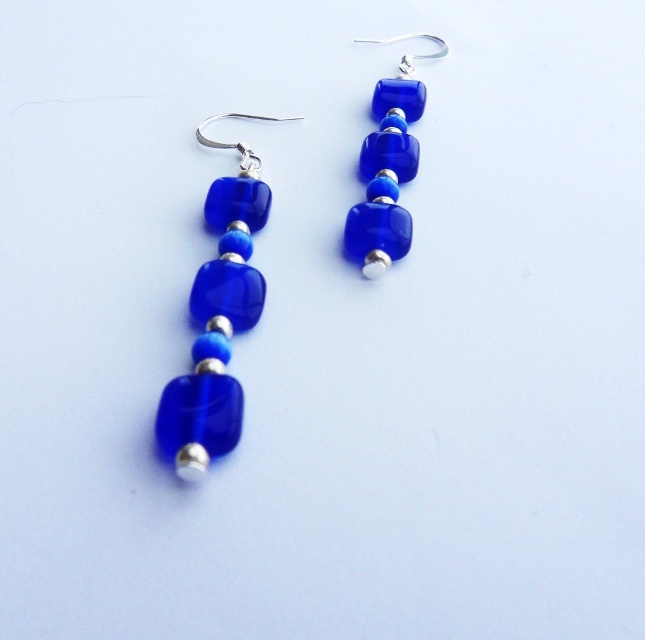
You are an earring designer looking at the image. You need to place a new silver spacer between the cobalt glass bead at left and the cobalt glass cube at center. Based on their positions, which direction should you move the spacer to place it between them?

You should move the silver spacer to the right of the cobalt glass bead at left and to the left of the cobalt glass cube at center, placing it between them.

You are a customer looking at the earrings and want to know if the cobalt glass bead at left is above or below the cobalt glass cube at center. Can you tell me?

The cobalt glass bead at left is positioned under the cobalt glass cube at center, so it is below.

Looking at this image, you are holding a magnifying glass to examine the cobalt glass bead at left. If the bead is 1.17 meters away from you, can you clearly see its surface details without moving closer?

The cobalt glass bead at left is 1.17 meters away from the viewer, so yes, you can clearly see its surface details without moving closer.